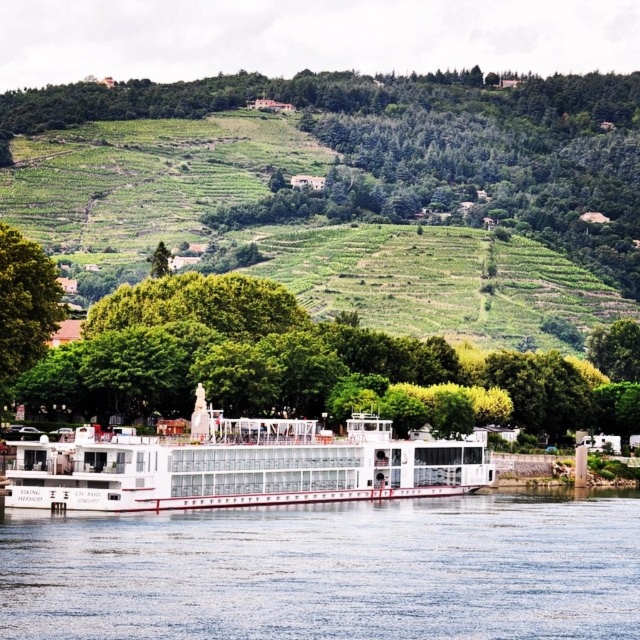
Measure the distance between point (131, 573) and camera.

Point (131, 573) is 188.85 feet away from camera.

Between blue glassy water at lower center and white glassy boat at center, which one appears on the left side from the viewer's perspective?

white glassy boat at center

Between point (568, 589) and point (374, 468), which one is positioned behind?

The point (374, 468) is more distant.

This screenshot has width=640, height=640. I want to click on blue glassy water at lower center, so click(x=328, y=570).

Who is higher up, green leafy tree at center or white glassy boat at center?

green leafy tree at center

Based on the photo, can you confirm if green leafy tree at center is taller than white glassy boat at center?

Indeed, green leafy tree at center has a greater height compared to white glassy boat at center.

Describe the element at coordinates (280, 362) in the screenshot. I see `green leafy tree at center` at that location.

You are a GUI agent. You are given a task and a screenshot of the screen. Output one action in this format:
    pyautogui.click(x=<x>, y=<y>)
    Task: Click on the green leafy tree at center
    
    Given the screenshot: What is the action you would take?
    pyautogui.click(x=280, y=362)

Which of these two, white glassy boat at center or green leafy tree at left, stands taller?

green leafy tree at left

Does white glassy boat at center appear over green leafy tree at left?

Incorrect, white glassy boat at center is not positioned above green leafy tree at left.

Where is `white glassy boat at center`? white glassy boat at center is located at coordinates (240, 465).